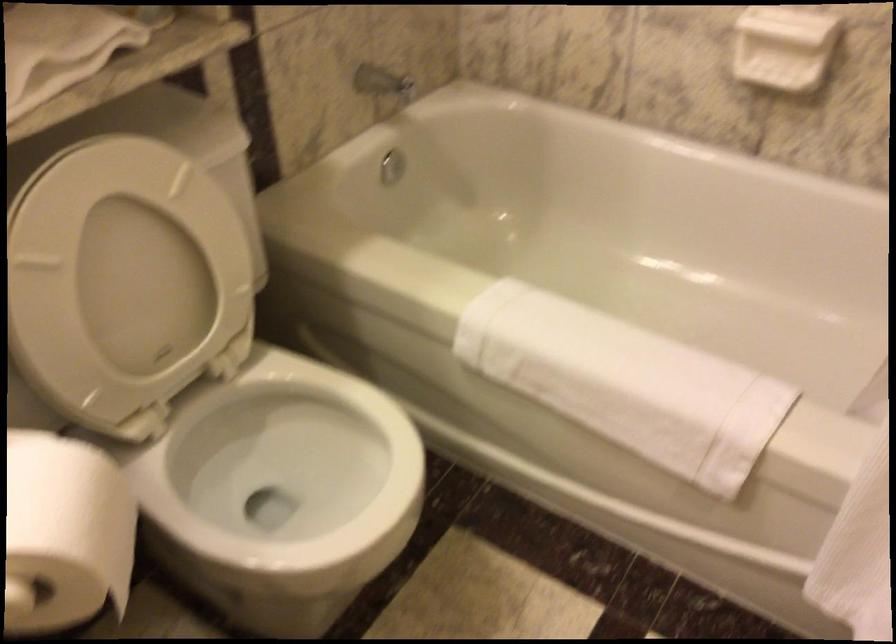
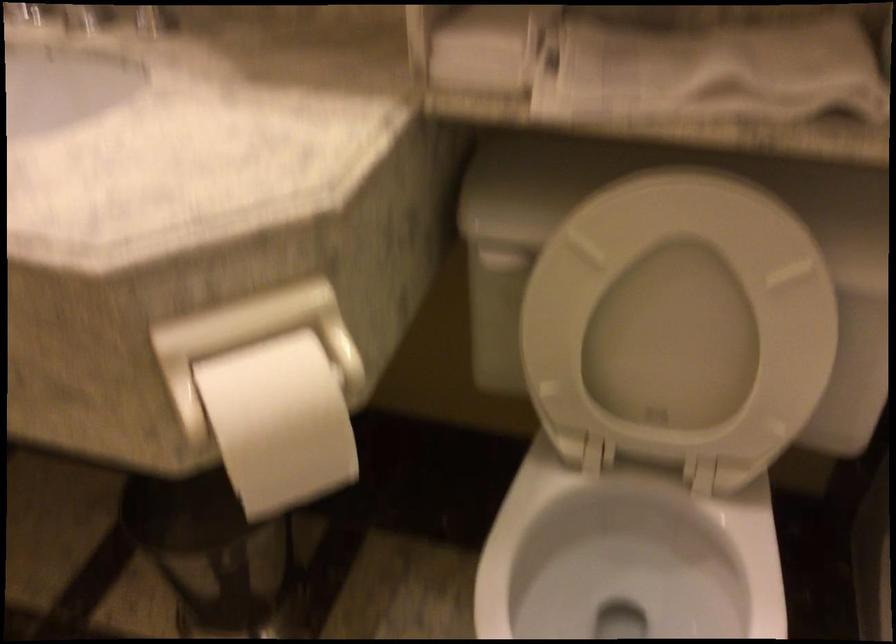
In the second image, find the point that corresponds to the point at 239,496 in the first image.

(609, 574)